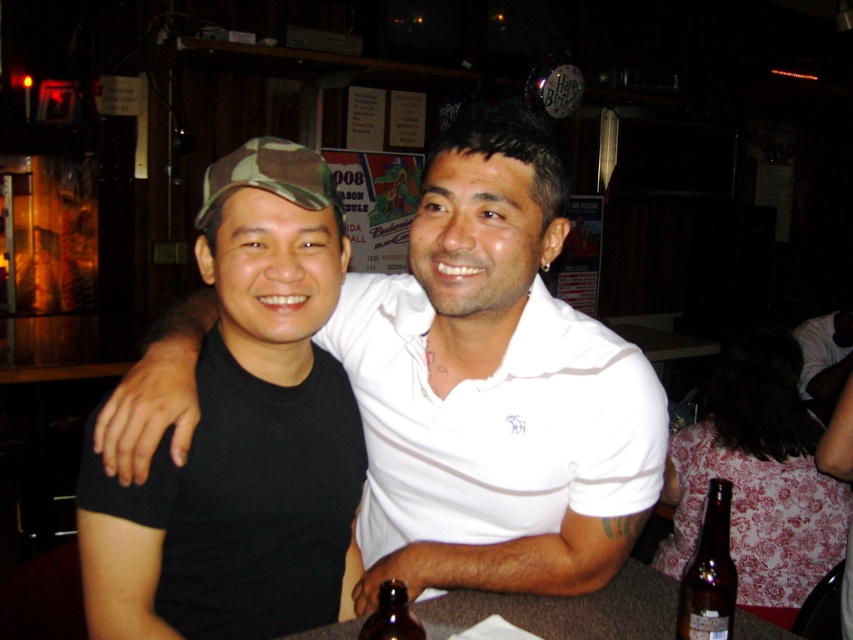
Who is positioned more to the right, black matte shirt at center or black matte cap at left?

black matte shirt at center

Does black matte shirt at center appear on the left side of black matte cap at left?

No, black matte shirt at center is not to the left of black matte cap at left.

At what (x,y) coordinates should I click in order to perform the action: click on black matte shirt at center. Please return your answer as a coordinate pair (x, y). The image size is (853, 640). Looking at the image, I should click on (x=492, y=387).

This screenshot has width=853, height=640. I want to click on black matte shirt at center, so click(492, 387).

Based on the photo, is black matte cap at left below brown glass bottle at lower right?

Actually, black matte cap at left is above brown glass bottle at lower right.

Based on the photo, is black matte cap at left positioned behind brown glass bottle at lower right?

No, black matte cap at left is closer to the viewer.

What do you see at coordinates (242, 433) in the screenshot? I see `black matte cap at left` at bounding box center [242, 433].

Identify the location of black matte cap at left. (242, 433).

Does black matte shirt at center appear under brown matte table at lower center?

Actually, black matte shirt at center is above brown matte table at lower center.

Who is higher up, black matte shirt at center or brown matte table at lower center?

Positioned higher is black matte shirt at center.

Between point (521, 248) and point (770, 628), which one is positioned behind?

The point (770, 628) is behind.

Find the location of a particular element. This screenshot has height=640, width=853. black matte shirt at center is located at coordinates (492, 387).